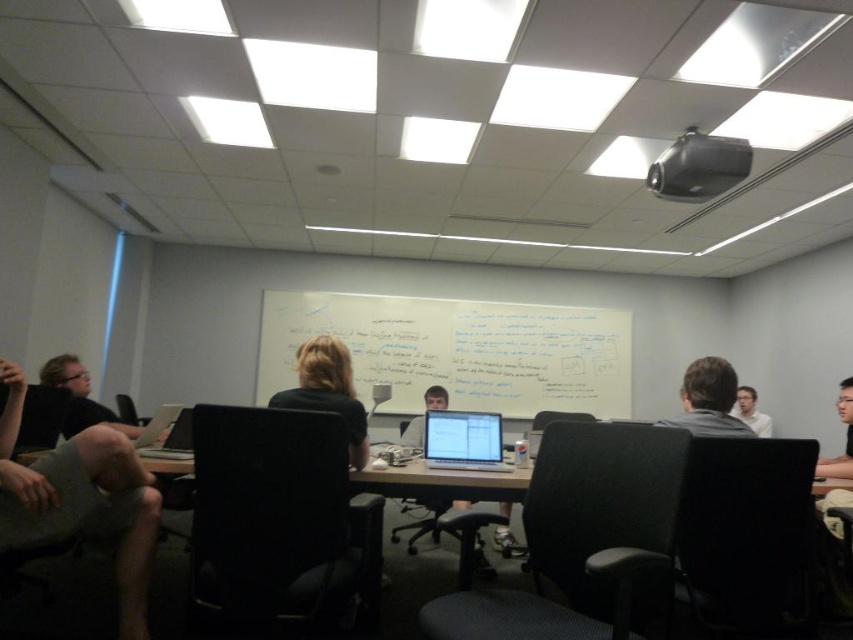
You are standing in the room and want to write on the whiteboard at center. Based on its 2D coordinates, which direction should you face to ensure you are directly in front of it?

The whiteboard at center is located at coordinates 0.548 on the x and 0.537 on the y axis, so facing the center of the room would place you directly in front of it.

You are a participant in the meeting and need to present your slides from the laptop. Can you easily access the satin black laptop at center while facing the whiteboard at center?

The satin black laptop at center is behind the whiteboard at center, so you would have to move around or behind the whiteboard to access it, making it difficult to reach while facing the whiteboard.